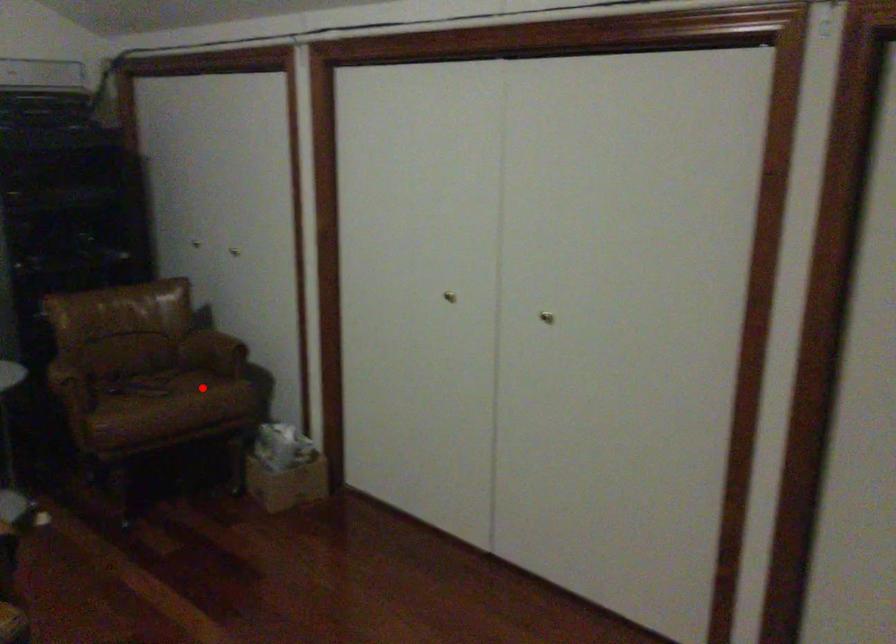
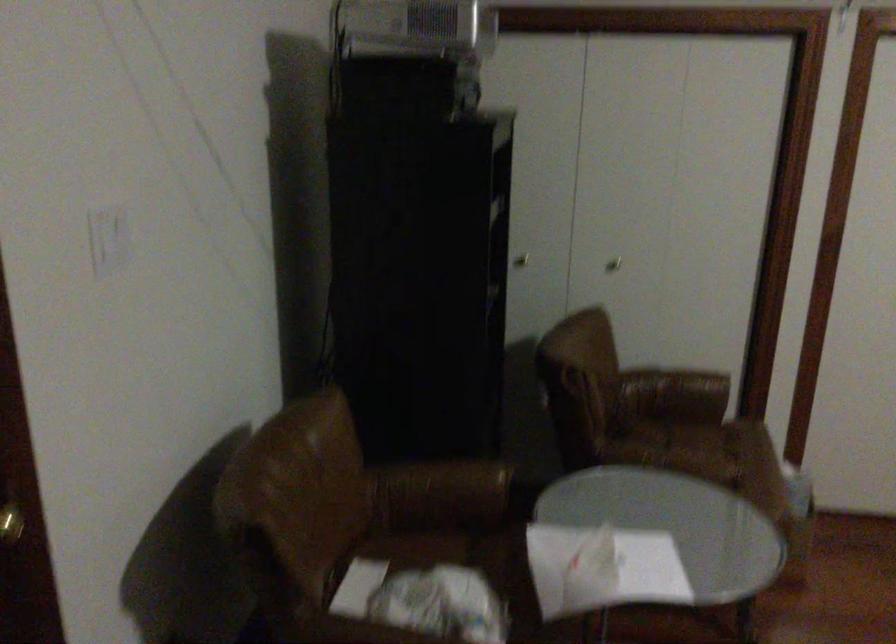
Find the pixel in the second image that matches the highlighted location in the first image.

(718, 442)